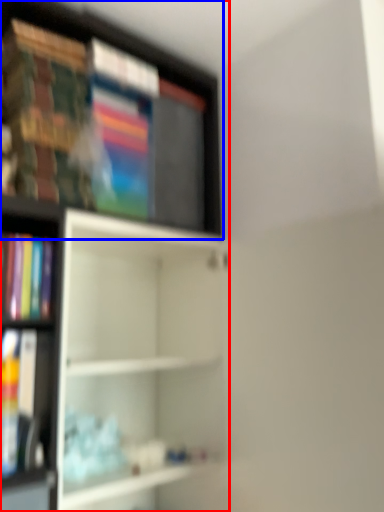
Question: Which object appears closest to the camera in this image, shelf (highlighted by a red box) or shelf (highlighted by a blue box)?

Choices:
 (A) shelf
 (B) shelf

Answer: (A)